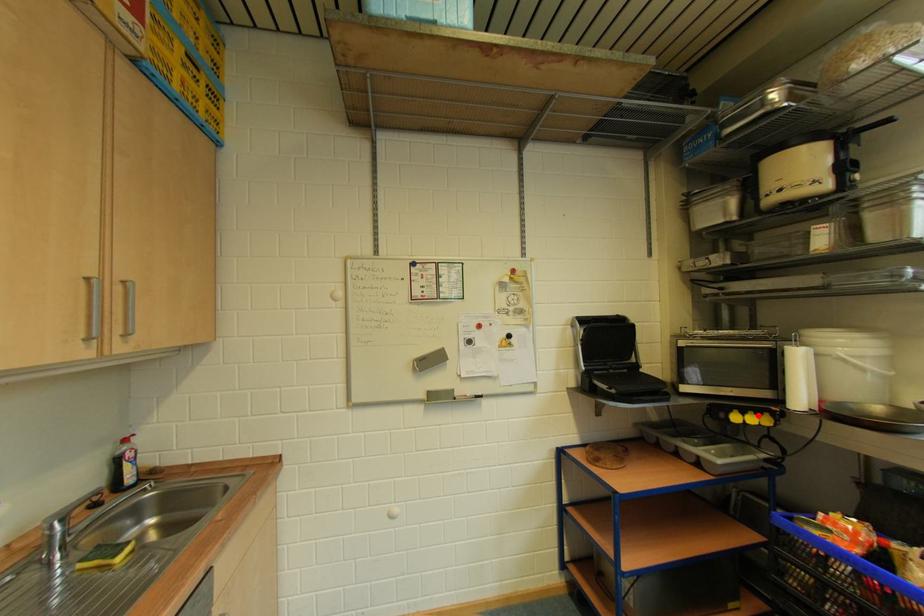
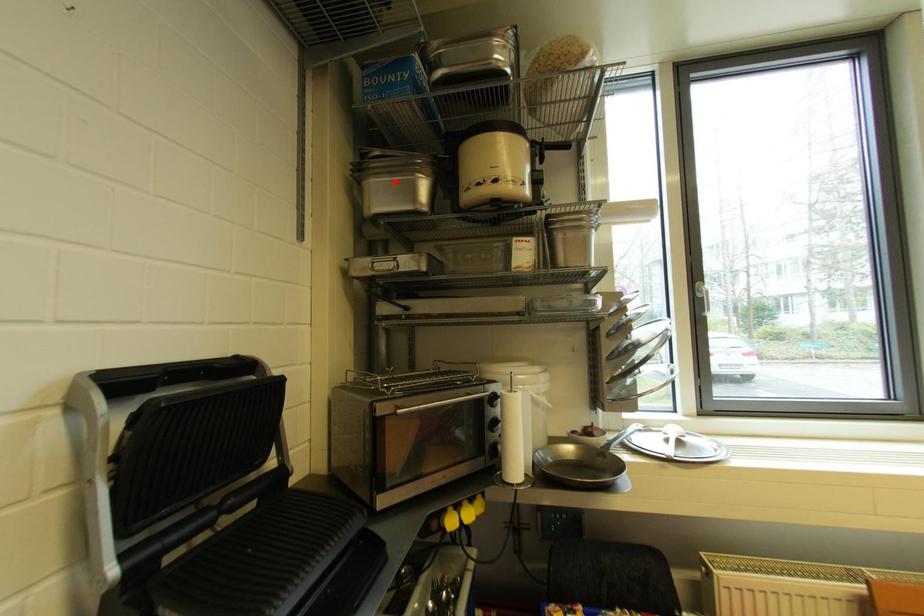
I am providing you with two images of the same scene from different viewpoints. A red point is marked on the first image and another point is marked on the second image. Do the highlighted points in image1 and image2 indicate the same real-world spot?

No